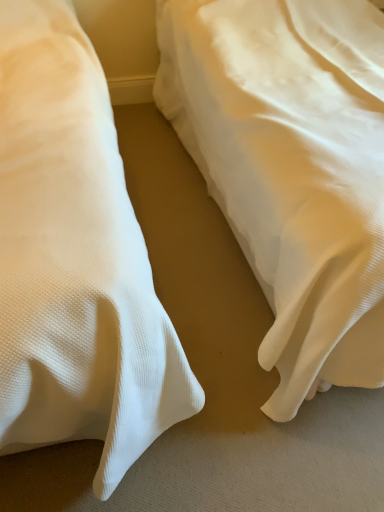
Image resolution: width=384 pixels, height=512 pixels. What are the coordinates of `white textured bed at right, positioned as the 2th bed in right-to-left order` in the screenshot? It's located at (75, 260).

Describe the element at coordinates (75, 260) in the screenshot. Image resolution: width=384 pixels, height=512 pixels. I see `white textured bed at right, marked as the first bed in a left-to-right arrangement` at that location.

Where is `white textured bed at center, the first bed when ordered from right to left`? white textured bed at center, the first bed when ordered from right to left is located at coordinates (291, 169).

The image size is (384, 512). Describe the element at coordinates (291, 169) in the screenshot. I see `white textured bed at center, acting as the second bed starting from the left` at that location.

This screenshot has height=512, width=384. I want to click on white textured bed at right, marked as the first bed in a left-to-right arrangement, so click(x=75, y=260).

Which object is positioned more to the right, white textured bed at center, acting as the second bed starting from the left, or white textured bed at right, positioned as the 2th bed in right-to-left order?

white textured bed at center, acting as the second bed starting from the left.

Based on the photo, which object is further away from the camera taking this photo, white textured bed at center, acting as the second bed starting from the left, or white textured bed at right, positioned as the 2th bed in right-to-left order?

white textured bed at center, acting as the second bed starting from the left, is further from the camera.

Based on the photo, which point is more distant from viewer, (380, 269) or (45, 167)?

The point (45, 167) is farther from the camera.

Looking at this image, from the image's perspective, is white textured bed at center, the first bed when ordered from right to left, below white textured bed at right, positioned as the 2th bed in right-to-left order?

No, from the image's perspective, white textured bed at center, the first bed when ordered from right to left, is not beneath white textured bed at right, positioned as the 2th bed in right-to-left order.

From a real-world perspective, is white textured bed at center, the first bed when ordered from right to left, positioned over white textured bed at right, marked as the first bed in a left-to-right arrangement, based on gravity?

Incorrect, from a real-world perspective, white textured bed at center, the first bed when ordered from right to left, is lower than white textured bed at right, marked as the first bed in a left-to-right arrangement.

Can you confirm if white textured bed at center, acting as the second bed starting from the left, is thinner than white textured bed at right, positioned as the 2th bed in right-to-left order?

Correct, the width of white textured bed at center, acting as the second bed starting from the left, is less than that of white textured bed at right, positioned as the 2th bed in right-to-left order.

Can you confirm if white textured bed at center, the first bed when ordered from right to left, is shorter than white textured bed at right, positioned as the 2th bed in right-to-left order?

Yes, white textured bed at center, the first bed when ordered from right to left, is shorter than white textured bed at right, positioned as the 2th bed in right-to-left order.

Between white textured bed at center, the first bed when ordered from right to left, and white textured bed at right, positioned as the 2th bed in right-to-left order, which one has smaller size?

white textured bed at right, positioned as the 2th bed in right-to-left order.

Does white textured bed at center, the first bed when ordered from right to left, contain white textured bed at right, positioned as the 2th bed in right-to-left order?

No.

Are white textured bed at center, the first bed when ordered from right to left, and white textured bed at right, positioned as the 2th bed in right-to-left order, beside each other?

No, white textured bed at center, the first bed when ordered from right to left, is not in contact with white textured bed at right, positioned as the 2th bed in right-to-left order.

Is white textured bed at right, positioned as the 2th bed in right-to-left order, at the back of white textured bed at center, the first bed when ordered from right to left?

No, white textured bed at right, positioned as the 2th bed in right-to-left order, is not at the back of white textured bed at center, the first bed when ordered from right to left.

From the picture: Can you tell me how much white textured bed at center, the first bed when ordered from right to left, and white textured bed at right, positioned as the 2th bed in right-to-left order, differ in facing direction?

0.000127 degrees.

In the image, there is a white textured bed at right, marked as the first bed in a left-to-right arrangement. At what (x,y) coordinates should I click in order to perform the action: click on bed above it (from the image's perspective). Please return your answer as a coordinate pair (x, y). The image size is (384, 512). Looking at the image, I should click on (291, 169).

Is white textured bed at right, marked as the first bed in a left-to-right arrangement, to the left or to the right of white textured bed at center, the first bed when ordered from right to left, in the image?

white textured bed at right, marked as the first bed in a left-to-right arrangement, is to the left of white textured bed at center, the first bed when ordered from right to left.

Is white textured bed at right, marked as the first bed in a left-to-right arrangement, closer to camera compared to white textured bed at center, acting as the second bed starting from the left?

That is True.

Considering the positions of points (137, 382) and (352, 34), is point (137, 382) closer to camera compared to point (352, 34)?

That is True.

From the image's perspective, between white textured bed at right, marked as the first bed in a left-to-right arrangement, and white textured bed at center, acting as the second bed starting from the left, who is located below?

white textured bed at right, marked as the first bed in a left-to-right arrangement, appears lower in the image.

From a real-world perspective, does white textured bed at right, marked as the first bed in a left-to-right arrangement, sit lower than white textured bed at center, the first bed when ordered from right to left?

No, from a real-world perspective, white textured bed at right, marked as the first bed in a left-to-right arrangement, is not under white textured bed at center, the first bed when ordered from right to left.

Is white textured bed at right, positioned as the 2th bed in right-to-left order, wider or thinner than white textured bed at center, the first bed when ordered from right to left?

Considering their sizes, white textured bed at right, positioned as the 2th bed in right-to-left order, looks broader than white textured bed at center, the first bed when ordered from right to left.

Considering the sizes of objects white textured bed at right, marked as the first bed in a left-to-right arrangement, and white textured bed at center, acting as the second bed starting from the left, in the image provided, who is taller, white textured bed at right, marked as the first bed in a left-to-right arrangement, or white textured bed at center, acting as the second bed starting from the left,?

white textured bed at right, marked as the first bed in a left-to-right arrangement.

Considering the sizes of white textured bed at right, marked as the first bed in a left-to-right arrangement, and white textured bed at center, acting as the second bed starting from the left, in the image, is white textured bed at right, marked as the first bed in a left-to-right arrangement, bigger or smaller than white textured bed at center, acting as the second bed starting from the left,?

Clearly, white textured bed at right, marked as the first bed in a left-to-right arrangement, is smaller in size than white textured bed at center, acting as the second bed starting from the left.

Is white textured bed at right, positioned as the 2th bed in right-to-left order, positioned beyond the bounds of white textured bed at center, acting as the second bed starting from the left?

white textured bed at right, positioned as the 2th bed in right-to-left order, lies outside white textured bed at center, acting as the second bed starting from the left,'s area.

Is the surface of white textured bed at right, positioned as the 2th bed in right-to-left order, in direct contact with white textured bed at center, acting as the second bed starting from the left?

white textured bed at right, positioned as the 2th bed in right-to-left order, and white textured bed at center, acting as the second bed starting from the left, are not in contact.

Is white textured bed at right, positioned as the 2th bed in right-to-left order, aimed at white textured bed at center, acting as the second bed starting from the left?

No, white textured bed at right, positioned as the 2th bed in right-to-left order, is not oriented towards white textured bed at center, acting as the second bed starting from the left.

Based on the photo, how different are the orientations of white textured bed at right, positioned as the 2th bed in right-to-left order, and white textured bed at center, acting as the second bed starting from the left, in degrees?

0.000127 degrees.

Measure the distance from white textured bed at right, positioned as the 2th bed in right-to-left order, to white textured bed at center, the first bed when ordered from right to left.

white textured bed at right, positioned as the 2th bed in right-to-left order, and white textured bed at center, the first bed when ordered from right to left, are 54.56 centimeters apart.

This screenshot has width=384, height=512. What are the coordinates of `bed behind the white textured bed at right, marked as the first bed in a left-to-right arrangement` in the screenshot? It's located at (291, 169).

Where is `bed located in front of the white textured bed at center, the first bed when ordered from right to left`? The image size is (384, 512). bed located in front of the white textured bed at center, the first bed when ordered from right to left is located at coordinates (75, 260).

Where is `bed lying on the left of white textured bed at center, acting as the second bed starting from the left`? The height and width of the screenshot is (512, 384). bed lying on the left of white textured bed at center, acting as the second bed starting from the left is located at coordinates (75, 260).